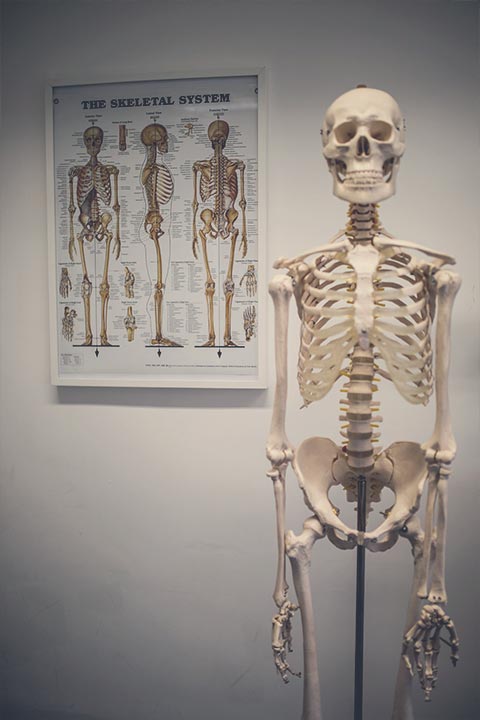
Identify the location of white picture frame. The height and width of the screenshot is (720, 480). (262, 137).